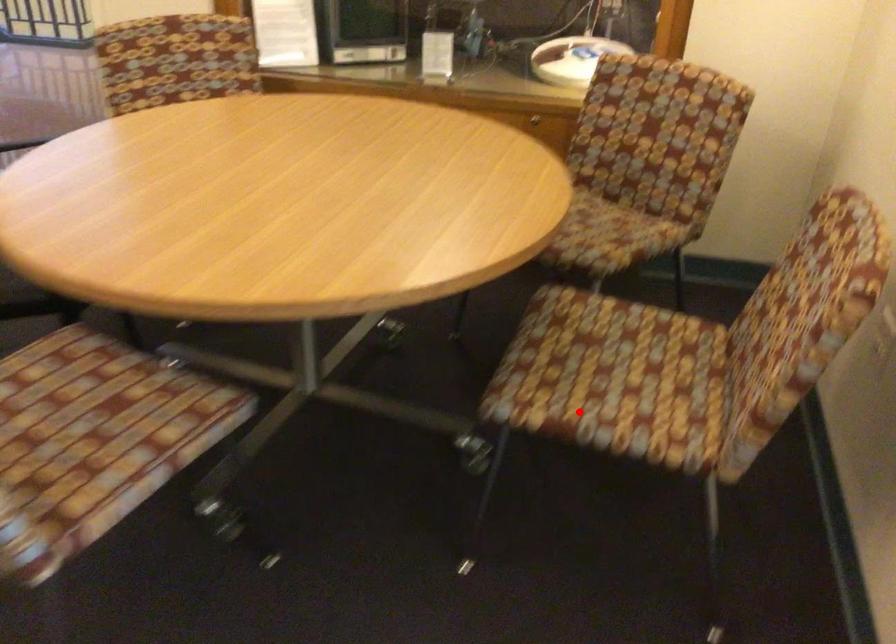
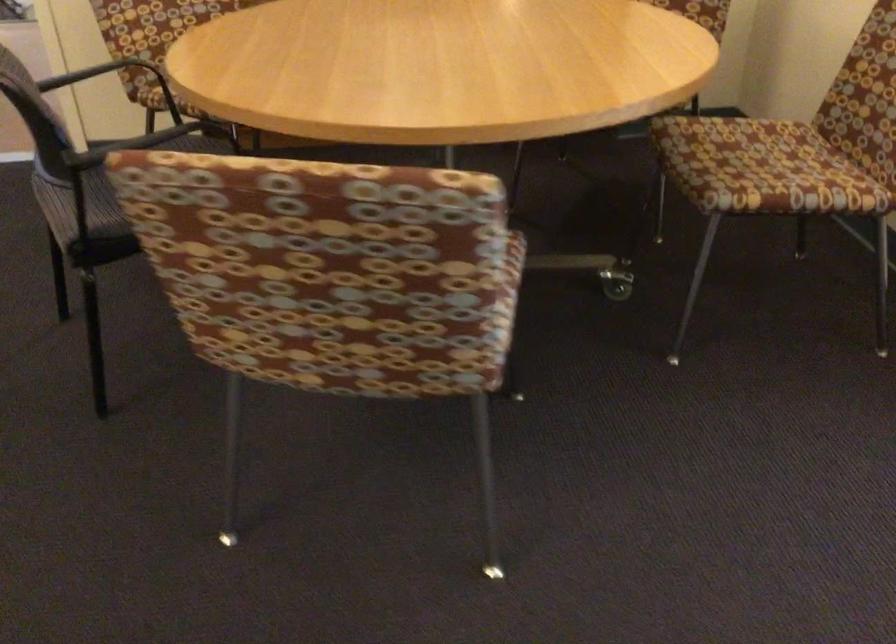
Locate, in the second image, the point that corresponds to the highlighted location in the first image.

(778, 187)